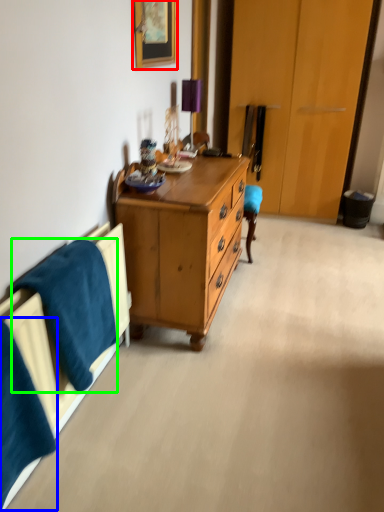
Question: Considering the real-world distances, which object is farthest from picture frame (highlighted by a red box)? blanket (highlighted by a blue box) or blanket (highlighted by a green box)?

Choices:
 (A) blanket
 (B) blanket

Answer: (A)